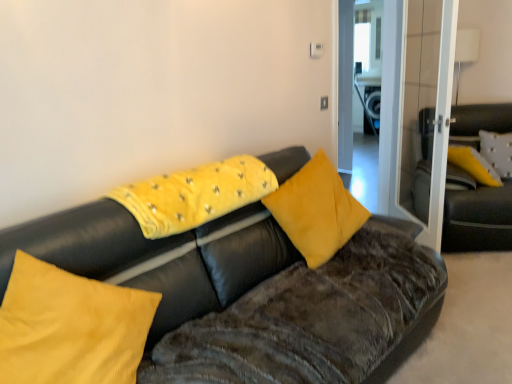
Question: Is transparent glass door at right not near velvet yellow pillow at center, which is the 4th pillow from right to left?

Choices:
 (A) yes
 (B) no

Answer: (A)

Question: Is transparent glass door at right further to the viewer compared to velvet yellow pillow at center, which ranks as the first pillow in front-to-back order?

Choices:
 (A) no
 (B) yes

Answer: (B)

Question: Is transparent glass door at right looking in the opposite direction of velvet yellow pillow at center, the first pillow viewed from the left?

Choices:
 (A) yes
 (B) no

Answer: (B)

Question: From the image's perspective, is transparent glass door at right located above velvet yellow pillow at center, which is the 4th pillow from right to left?

Choices:
 (A) no
 (B) yes

Answer: (B)

Question: Does transparent glass door at right come in front of velvet yellow pillow at center, the first pillow viewed from the left?

Choices:
 (A) no
 (B) yes

Answer: (A)

Question: Is transparent glass door at right smaller than velvet yellow pillow at center, which ranks as the first pillow in front-to-back order?

Choices:
 (A) yes
 (B) no

Answer: (B)

Question: From a real-world perspective, is velvet yellow pillow at center, placed as the third pillow when sorted from front to back, physically below velvet black couch at center, the first studio couch from the left?

Choices:
 (A) no
 (B) yes

Answer: (A)

Question: Is velvet yellow pillow at center, the second pillow viewed from the back, further to camera compared to velvet black couch at center, the first studio couch from the left?

Choices:
 (A) yes
 (B) no

Answer: (A)

Question: Is velvet yellow pillow at center, the second pillow viewed from the back, facing towards velvet black couch at center, the second studio couch when ordered from right to left?

Choices:
 (A) yes
 (B) no

Answer: (A)

Question: Can you confirm if velvet yellow pillow at center, the second pillow viewed from the back, is positioned to the right of velvet black couch at center, positioned as the second studio couch in back-to-front order?

Choices:
 (A) yes
 (B) no

Answer: (A)

Question: Does velvet yellow pillow at center, the second pillow viewed from the back, lie in front of velvet black couch at center, the second studio couch when ordered from right to left?

Choices:
 (A) yes
 (B) no

Answer: (B)

Question: Is velvet yellow pillow at center, the second pillow viewed from the back, not within velvet black couch at center, the first studio couch from the left?

Choices:
 (A) yes
 (B) no

Answer: (B)

Question: Is yellow fabric pillow at upper right, acting as the 4th pillow starting from the left, thinner than velvet black couch at right, which appears as the first studio couch when viewed from the right?

Choices:
 (A) yes
 (B) no

Answer: (A)